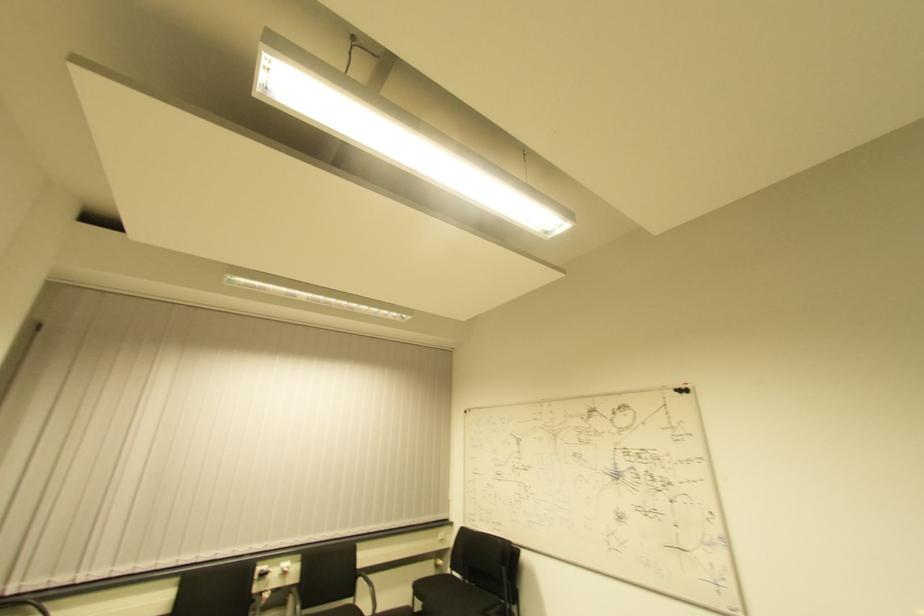
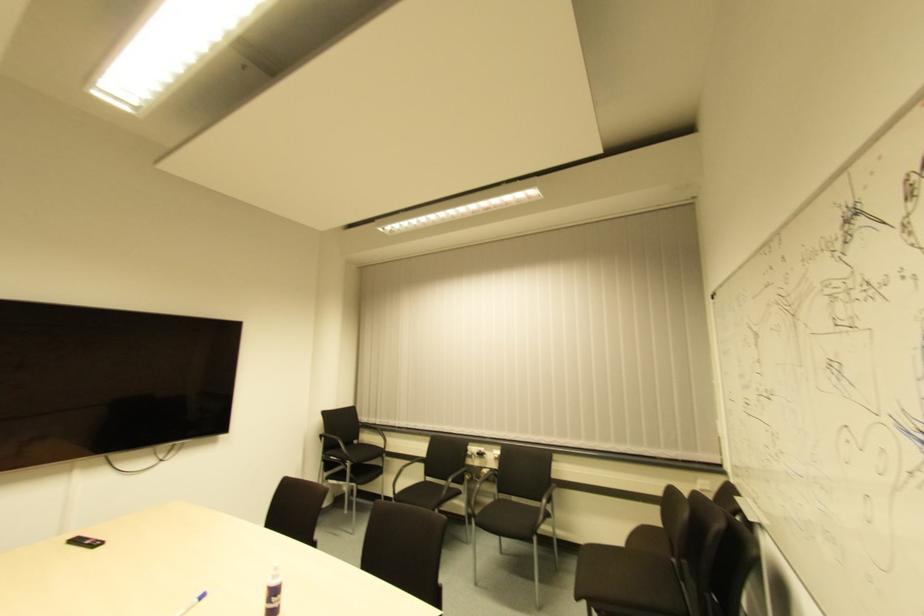
Locate, in the second image, the point that corresponds to point 257,567 in the first image.

(468, 447)